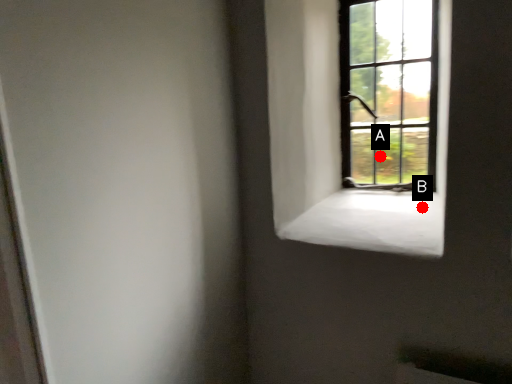
Question: Two points are circled on the image, labeled by A and B beside each circle. Among these points, which one is farthest from the camera?

Choices:
 (A) A is further
 (B) B is further

Answer: (A)